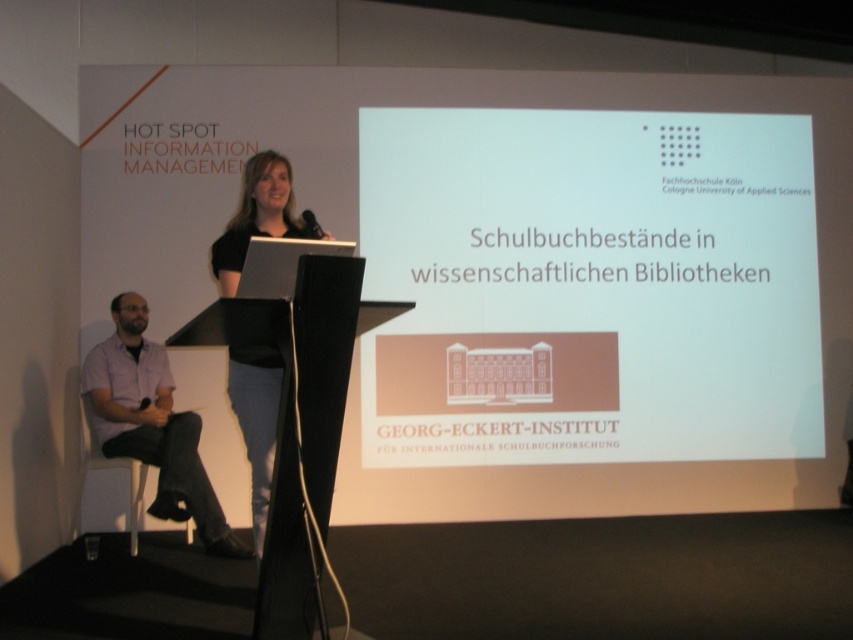
Question: Which of the following is the closest to the observer?

Choices:
 (A) black matte laptop at center
 (B) white plastic chair at lower left

Answer: (A)

Question: Does black matte laptop at center have a smaller size compared to white plastic chair at lower left?

Choices:
 (A) no
 (B) yes

Answer: (A)

Question: Among these points, which one is farthest from the camera?

Choices:
 (A) (265, 417)
 (B) (165, 497)
 (C) (303, 230)

Answer: (B)

Question: Among these objects, which one is farthest from the camera?

Choices:
 (A) purple cotton shirt at lower left
 (B) white plastic chair at lower left
 (C) black matte laptop at center
 (D) matte black microphone at upper center

Answer: (B)

Question: Does white plastic chair at lower left have a larger size compared to matte black microphone at upper center?

Choices:
 (A) no
 (B) yes

Answer: (B)

Question: Does black matte laptop at center come in front of matte black microphone at upper center?

Choices:
 (A) yes
 (B) no

Answer: (A)